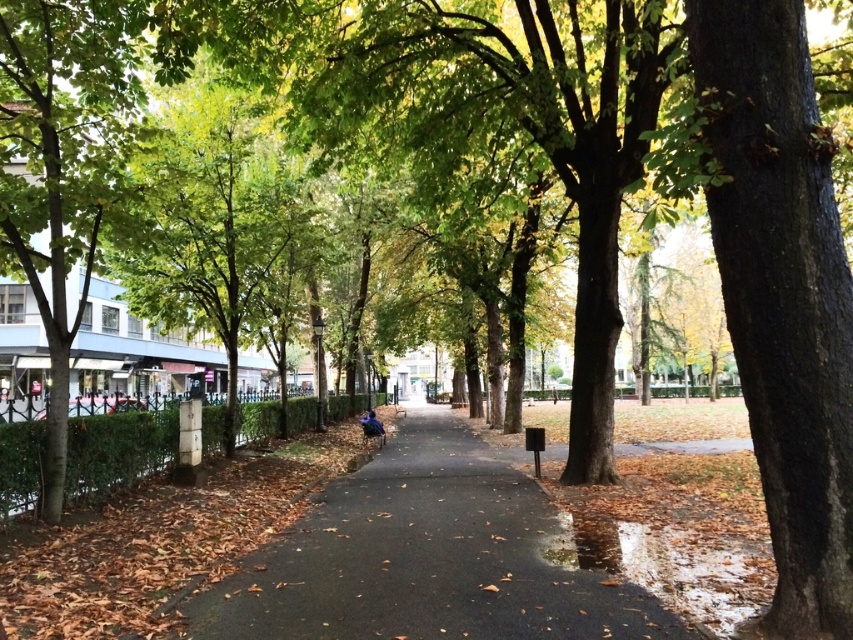
Is brown rough bark tree at right positioned behind blue fabric at center?

No, it is not.

Who is positioned more to the left, brown rough bark tree at right or blue fabric at center?

blue fabric at center

Between point (764, 228) and point (373, 419), which one is positioned behind?

Point (373, 419)

The image size is (853, 640). Identify the location of brown rough bark tree at right. (782, 294).

Can you confirm if brown rough bark tree at right is smaller than black asphalt pavement at center?

Yes, brown rough bark tree at right is smaller than black asphalt pavement at center.

Is point (837, 438) closer to viewer compared to point (254, 612)?

Yes, it is in front of point (254, 612).

You are a GUI agent. You are given a task and a screenshot of the screen. Output one action in this format:
    pyautogui.click(x=<x>, y=<y>)
    Task: Click on the brown rough bark tree at right
    The width and height of the screenshot is (853, 640).
    Given the screenshot: What is the action you would take?
    pyautogui.click(x=782, y=294)

Locate an element on the screen. brown rough bark tree at right is located at coordinates (782, 294).

Between black asphalt pavement at center and metallic blue bench at center, which one is positioned higher?

black asphalt pavement at center is above.

What do you see at coordinates (427, 557) in the screenshot? I see `black asphalt pavement at center` at bounding box center [427, 557].

At what (x,y) coordinates should I click in order to perform the action: click on black asphalt pavement at center. Please return your answer as a coordinate pair (x, y). The width and height of the screenshot is (853, 640). Looking at the image, I should click on (427, 557).